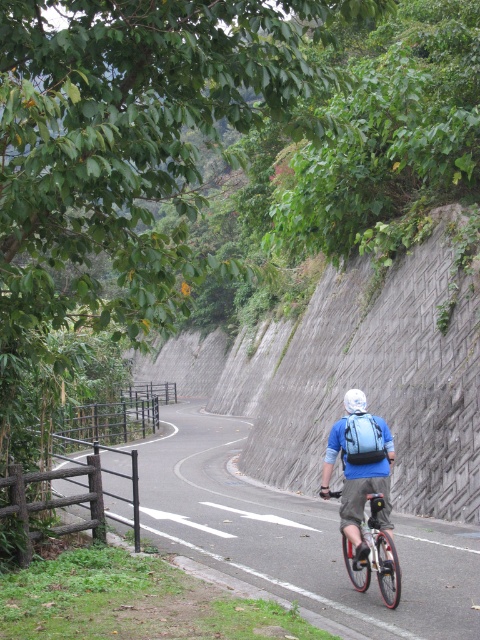
Between metallic silver bicycle at center and white matte bicycle helmet at center, which one has more height?

metallic silver bicycle at center

Can you confirm if metallic silver bicycle at center is smaller than white matte bicycle helmet at center?

Actually, metallic silver bicycle at center might be larger than white matte bicycle helmet at center.

The height and width of the screenshot is (640, 480). Describe the element at coordinates (374, 556) in the screenshot. I see `metallic silver bicycle at center` at that location.

Locate an element on the screen. This screenshot has width=480, height=640. metallic silver bicycle at center is located at coordinates (374, 556).

Who is positioned more to the right, asphalt road at center or blue fabric backpack at center?

blue fabric backpack at center is more to the right.

Who is taller, asphalt road at center or blue fabric backpack at center?

With more height is asphalt road at center.

Is point (291, 557) farther from camera compared to point (345, 420)?

That is True.

Image resolution: width=480 pixels, height=640 pixels. I want to click on asphalt road at center, so click(x=296, y=534).

Is the position of asphalt road at center more distant than that of white matte bicycle helmet at center?

That is False.

Who is shorter, asphalt road at center or white matte bicycle helmet at center?

Standing shorter between the two is white matte bicycle helmet at center.

This screenshot has height=640, width=480. In order to click on asphalt road at center in this screenshot , I will do `click(296, 534)`.

Locate an element on the screen. asphalt road at center is located at coordinates (x=296, y=534).